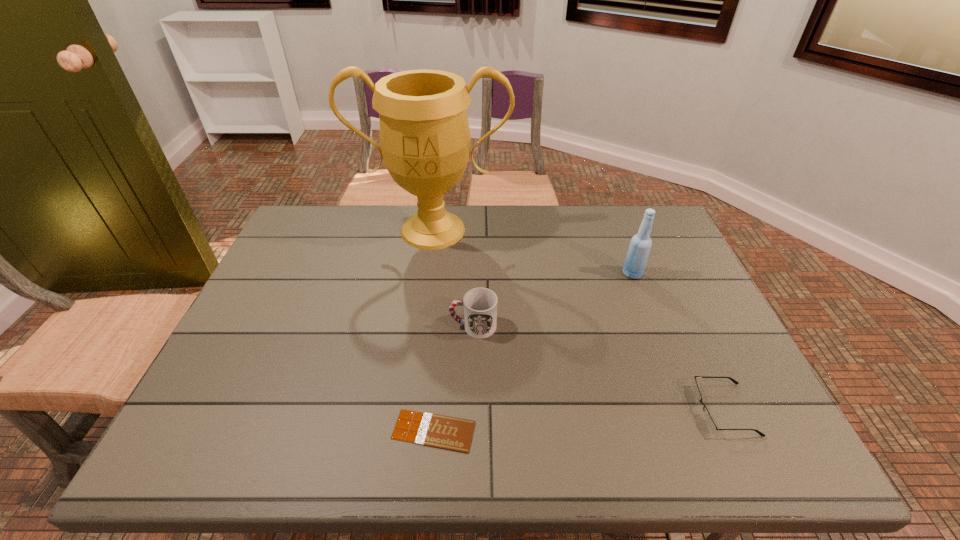
This screenshot has height=540, width=960. I want to click on bottle located at the right edge, so [x=640, y=245].

The image size is (960, 540). In order to click on spectacles that is at the right edge in this screenshot , I will do `click(709, 422)`.

At what (x,y) coordinates should I click in order to perform the action: click on object present at the near right corner. Please return your answer as a coordinate pair (x, y). This screenshot has width=960, height=540. Looking at the image, I should click on (709, 422).

Image resolution: width=960 pixels, height=540 pixels. In order to click on vacant space at the far edge of the desktop in this screenshot , I will do `click(540, 206)`.

This screenshot has height=540, width=960. In the image, there is a desktop. Identify the location of vacant area at the near edge. (508, 427).

Locate an element on the screen. blank space at the left edge is located at coordinates (231, 347).

You are a GUI agent. You are given a task and a screenshot of the screen. Output one action in this format:
    pyautogui.click(x=<x>, y=<y>)
    Task: Click on the vacant position at the right edge of the desktop
    The height and width of the screenshot is (540, 960).
    Given the screenshot: What is the action you would take?
    pyautogui.click(x=647, y=278)

In the image, there is a desktop. Where is `blank space at the far right corner`? blank space at the far right corner is located at coordinates (616, 216).

You are a GUI agent. You are given a task and a screenshot of the screen. Output one action in this format:
    pyautogui.click(x=<x>, y=<y>)
    Task: Click on the free space between the cup and the spectacles
    Image resolution: width=960 pixels, height=540 pixels.
    Given the screenshot: What is the action you would take?
    pyautogui.click(x=598, y=368)

Where is `free space that is in between the fourth shortest object and the fourth tallest object`? Image resolution: width=960 pixels, height=540 pixels. free space that is in between the fourth shortest object and the fourth tallest object is located at coordinates (678, 341).